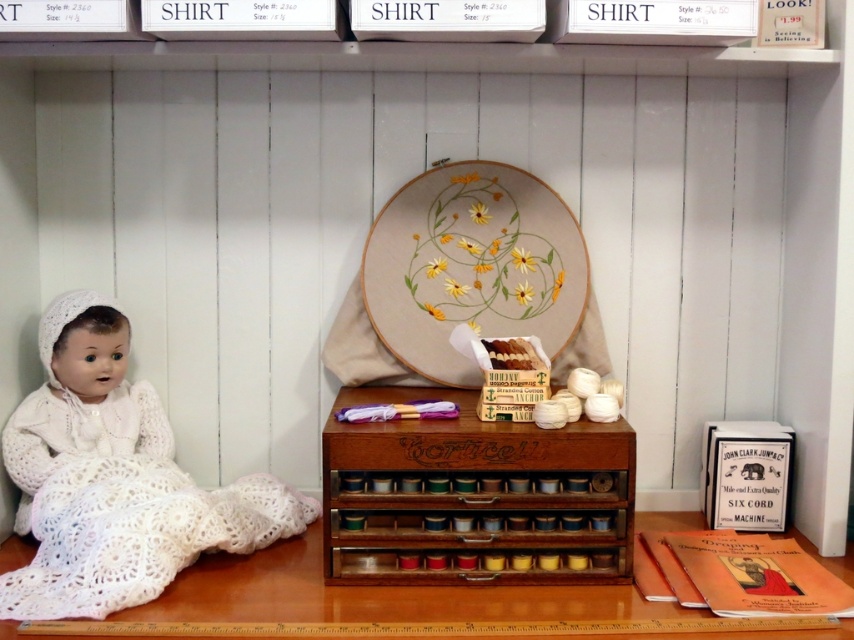
You are organizing a craft fair and need to place the white crocheted dress at left and the wooden table at lower center. According to the scene, which object should be positioned to the left side of the setup?

The white crocheted dress at left should be positioned to the left side of the setup because it is already to the left of the wooden table at lower center in the scene.

You are organizing a craft fair and have limited space on your display table. You need to place both the wooden spool rack at center and the white crocheted dress at left. Which item should you place first to maximize space efficiency?

The wooden spool rack at center is smaller than the white crocheted dress at left, so you should place the wooden spool rack at center first to maximize space efficiency by starting with the smaller item.

You are standing in front of a vintage sewing setup. There is a wooden embroidery hoop with yellow flowers and green leaves in the center and a small wooden box labeled Cortice below it. You need to place a new spool of thread at point (474, 497). Will this point be on the wooden spool rack at center?

Yes, the point (474, 497) is on the wooden spool rack at center, so placing the new spool of thread there will be on the wooden spool rack at center.